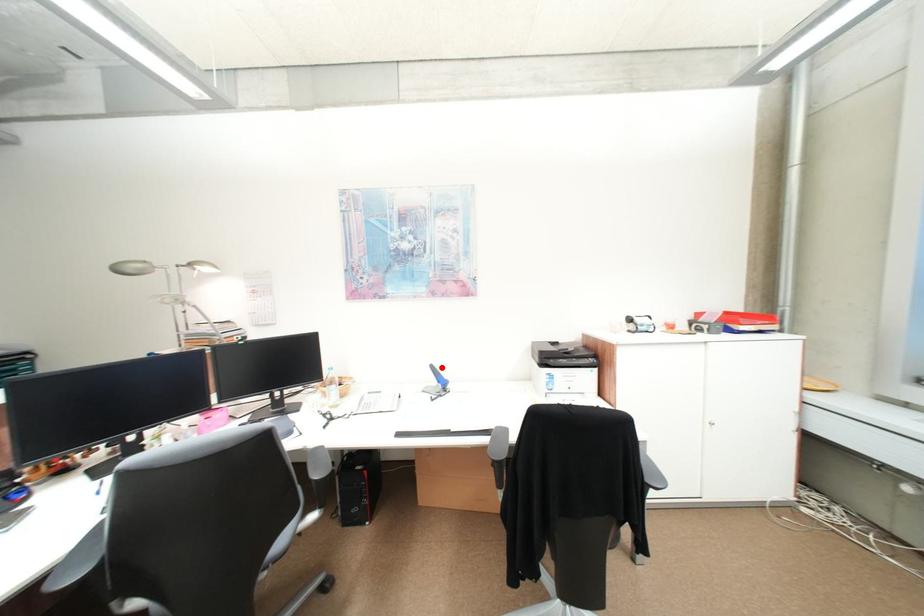
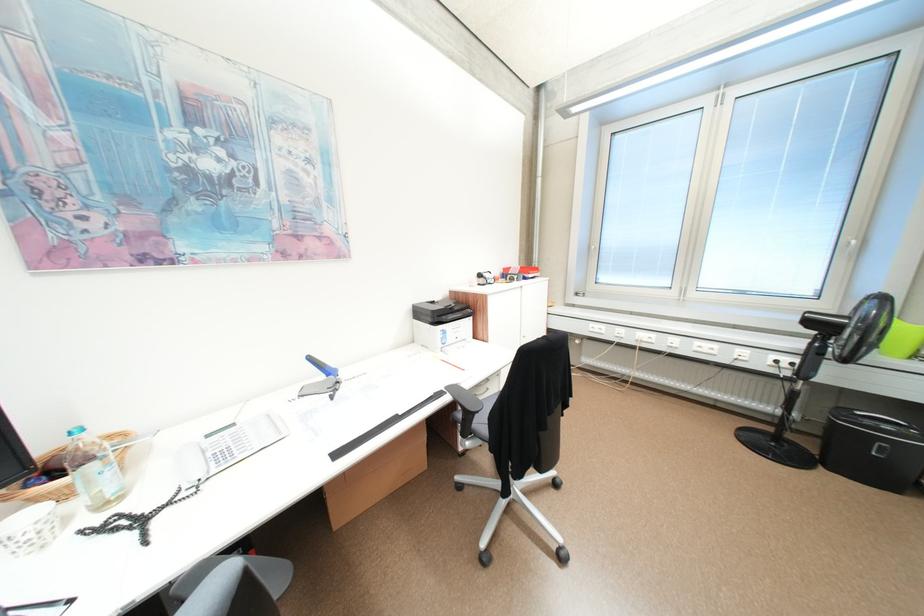
Question: I am providing you with two images of the same scene from different viewpoints. In image1, a red point is highlighted. Considering the same 3D point in image2, which of the following is correct?

Choices:
 (A) It is closer
 (B) It is farther

Answer: (A)